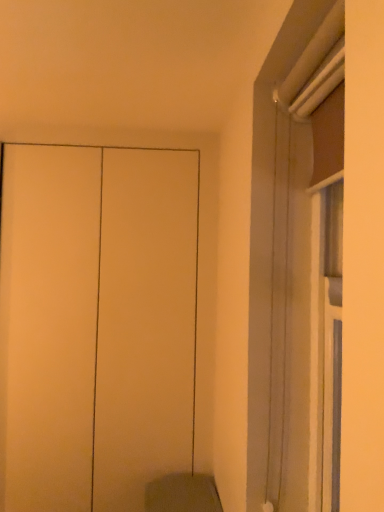
In order to face white matte cabinet at left, should I rotate leftwards or rightwards?

Rotate your view left by about 12.063°.

What do you see at coordinates (95, 323) in the screenshot?
I see `white matte cabinet at left` at bounding box center [95, 323].

Where is `white matte cabinet at left`? This screenshot has height=512, width=384. white matte cabinet at left is located at coordinates (95, 323).

Find the location of `white matte cabinet at left`. white matte cabinet at left is located at coordinates (95, 323).